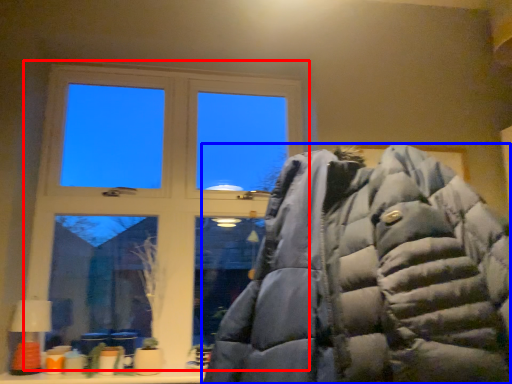
Question: Which object appears farthest to the camera in this image, window (highlighted by a red box) or jacket (highlighted by a blue box)?

Choices:
 (A) window
 (B) jacket

Answer: (A)